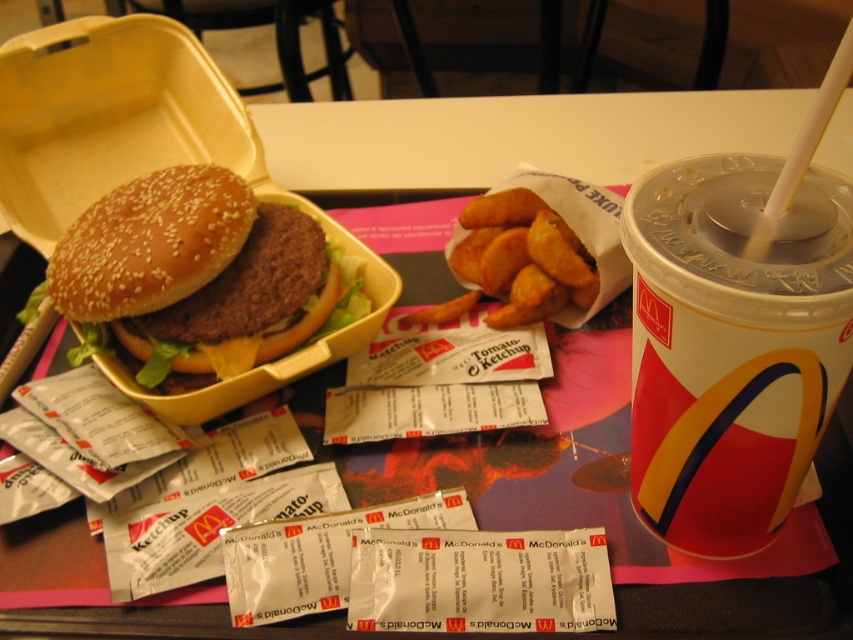
You are a customer at McDonalds and want to grab the sesame seed bun at center without moving the white plastic cup at upper right. Is this possible?

The white plastic cup at upper right is located below the sesame seed bun at center, so you can reach the sesame seed bun at center without moving the cup since it is positioned underneath.

You are a food delivery person who needs to pack the sesame seed bun at center and the white plastic cup at upper right into a narrow box. Which item will be harder to fit due to its width?

The sesame seed bun at center is wider than the white plastic cup at upper right, so it will be harder to fit into the narrow box.

You are a customer at McDonalds and want to place your straw into the white plastic cup at upper right. Where should you place the straw relative to the center of the table?

The white plastic cup at upper right is located at coordinates 0.539 on the x axis and 0.859 on the y axis, so you should place the straw slightly to the right and above the center of the table.